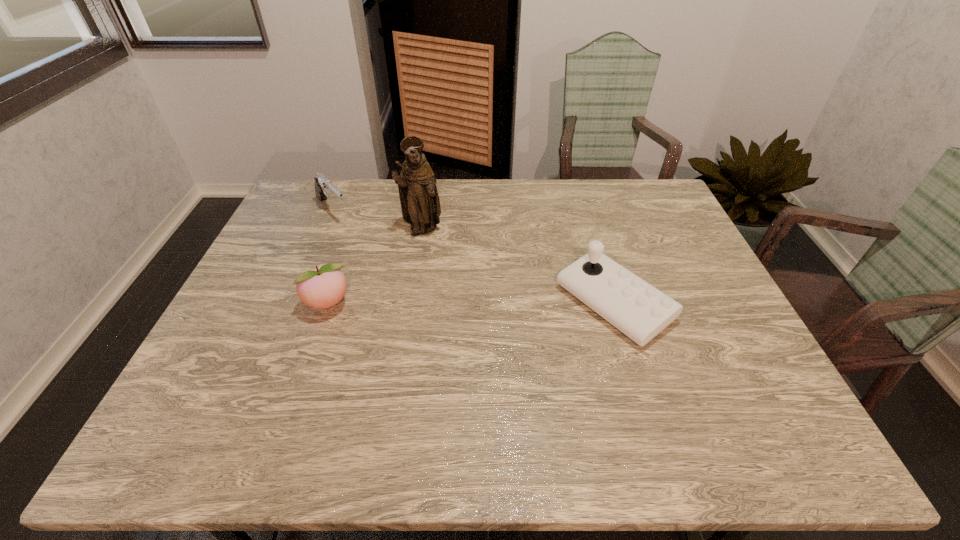
Where is `vacant point located at the muzzle of the gun`? vacant point located at the muzzle of the gun is located at coordinates (384, 260).

I want to click on blank space located 0.320m at the muzzle of the gun, so click(397, 272).

Identify the location of free space located 0.320m at the muzzle of the gun. (397, 272).

In order to click on object situated at the far edge in this screenshot , I will do `click(323, 185)`.

Find the location of `object that is positioned at the left edge`. object that is positioned at the left edge is located at coordinates (323, 185).

At what (x,y) coordinates should I click in order to perform the action: click on object at the right edge. Please return your answer as a coordinate pair (x, y). Looking at the image, I should click on tap(640, 311).

Locate an element on the screen. object that is at the far left corner is located at coordinates (x=323, y=185).

At what (x,y) coordinates should I click in order to perform the action: click on free space at the far edge. Please return your answer as a coordinate pair (x, y). Image resolution: width=960 pixels, height=540 pixels. Looking at the image, I should click on (516, 180).

The image size is (960, 540). Identify the location of vacant space at the near edge. point(560,385).

Where is `free point at the left edge`? Image resolution: width=960 pixels, height=540 pixels. free point at the left edge is located at coordinates (283, 238).